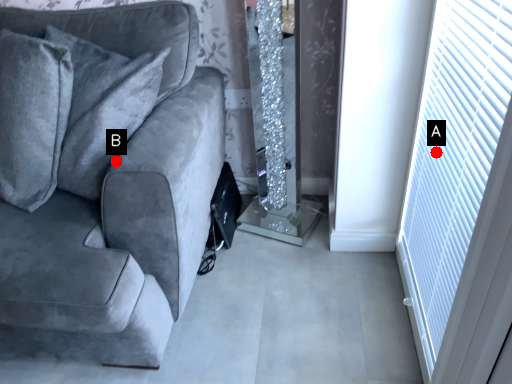
Question: Two points are circled on the image, labeled by A and B beside each circle. Which point is farther from the camera taking this photo?

Choices:
 (A) A is further
 (B) B is further

Answer: (A)